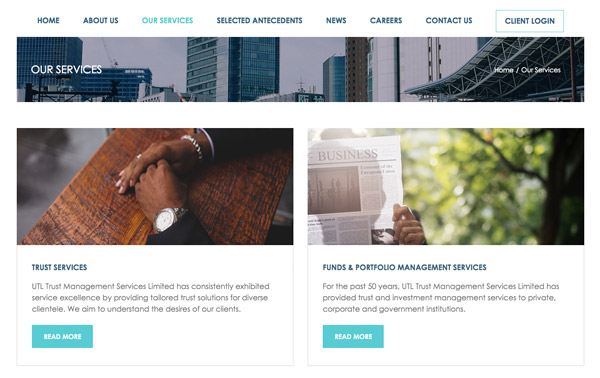
The width and height of the screenshot is (600, 378). I want to click on wooden table, so tap(99, 208).